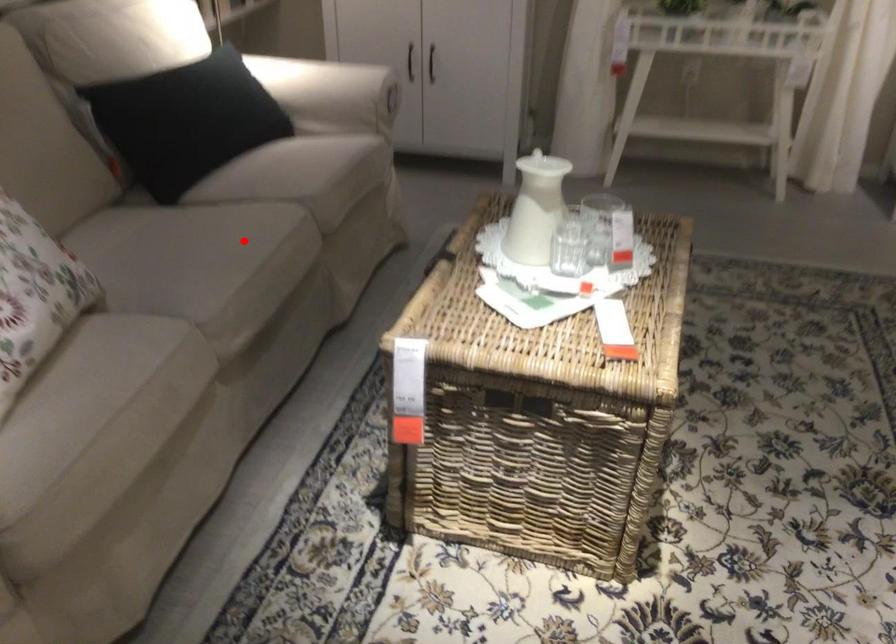
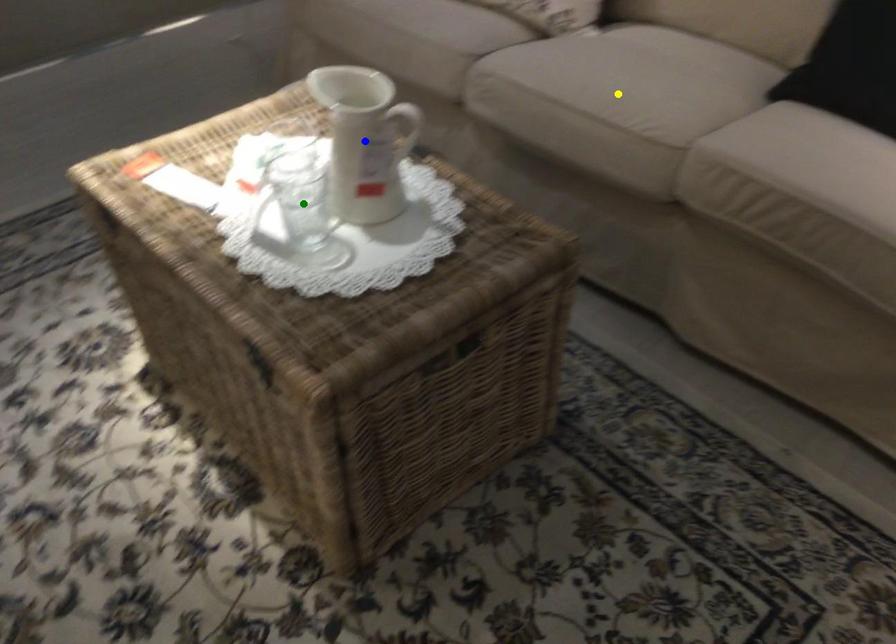
Question: I am providing you with two images of the same scene from different viewpoints. A red point is marked on the first image. You are given multiple points on the second image. Which spot in image 2 lines up with the point in image 1?

Choices:
 (A) blue point
 (B) yellow point
 (C) green point

Answer: (B)